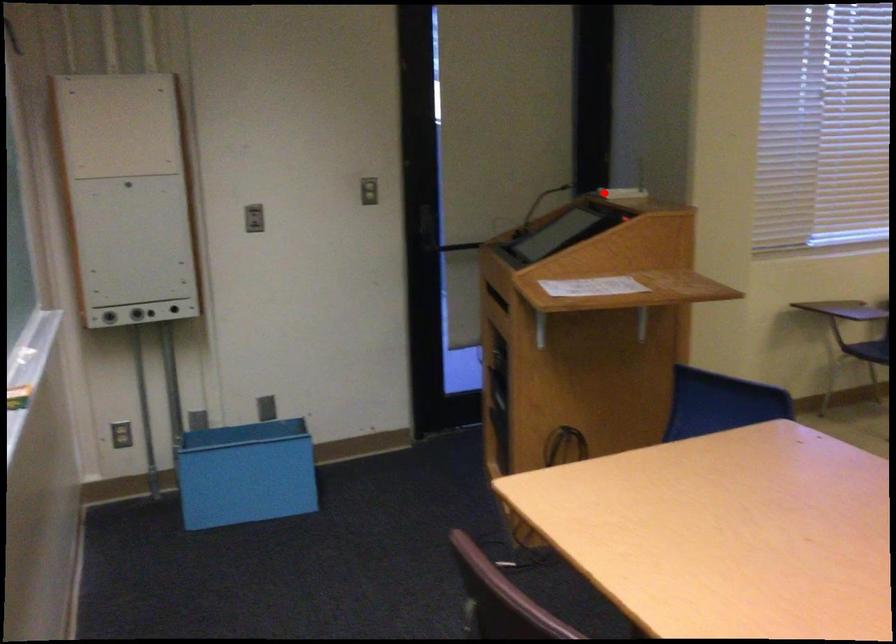
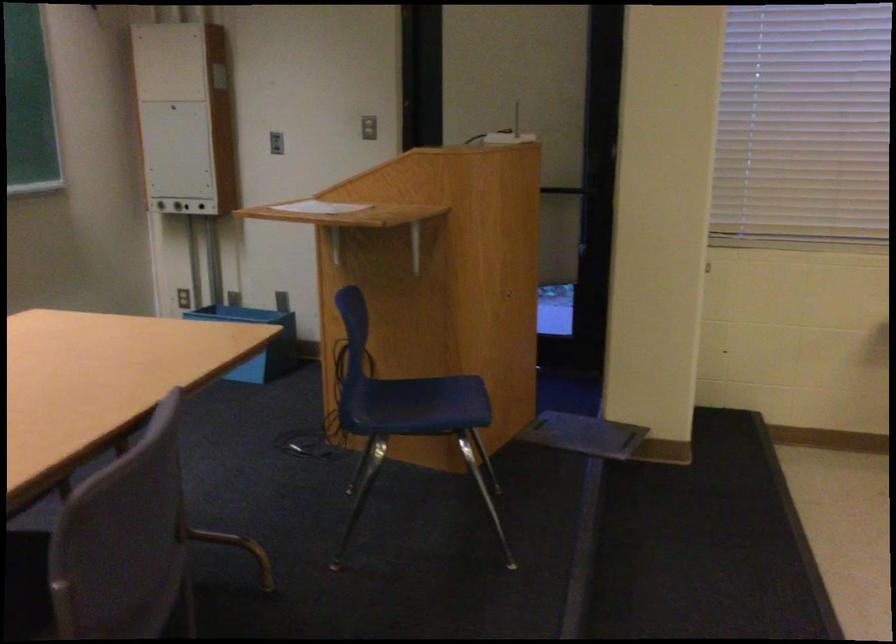
Find the pixel in the second image that matches the highlighted location in the first image.

(503, 136)